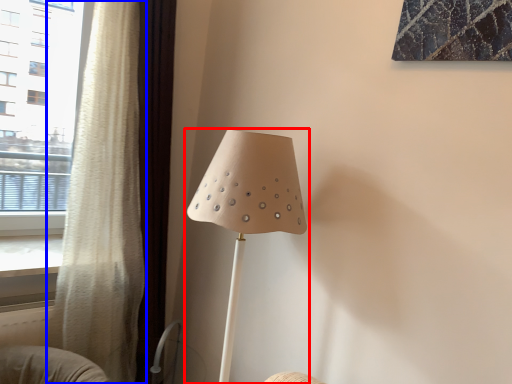
Question: Which object appears farthest to the camera in this image, lamp (highlighted by a red box) or curtain (highlighted by a blue box)?

Choices:
 (A) lamp
 (B) curtain

Answer: (B)